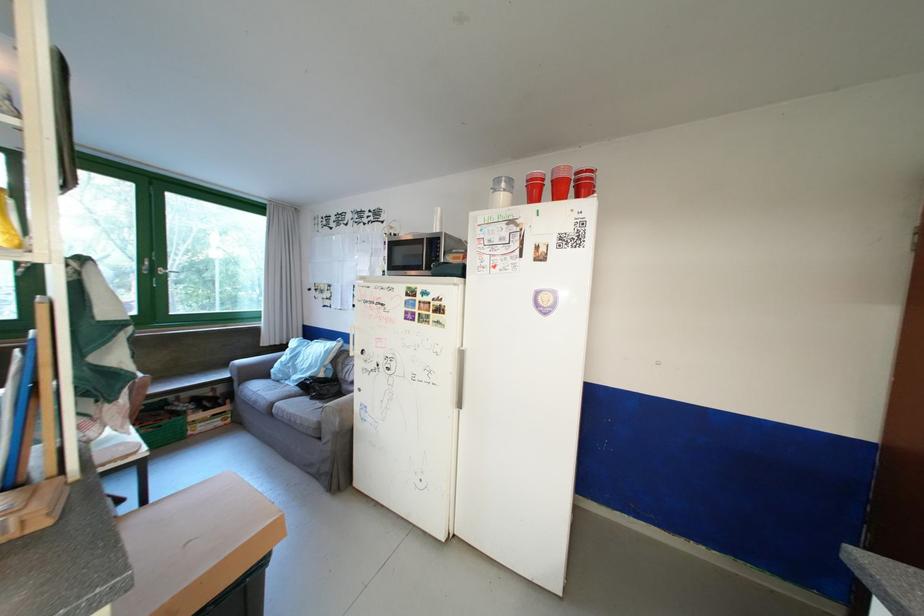
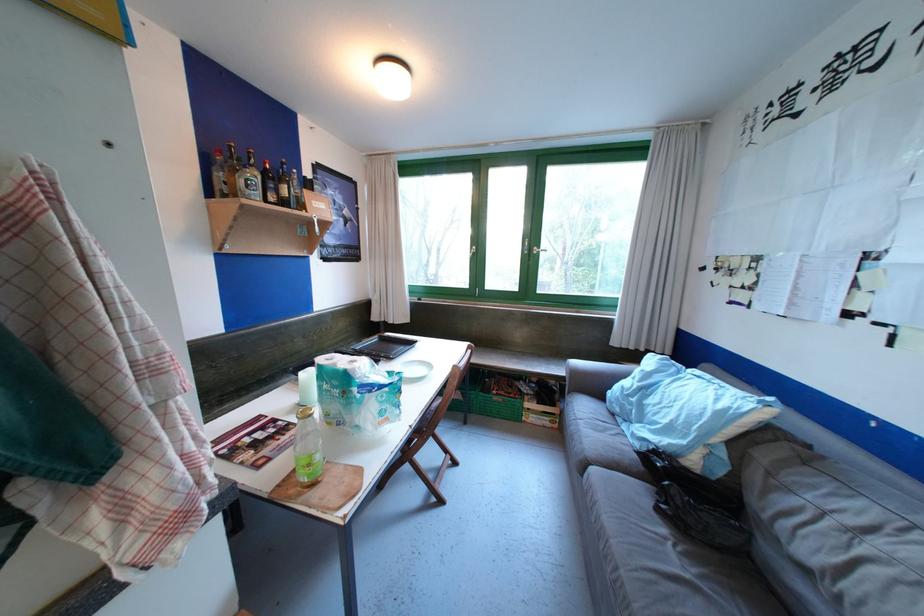
Locate, in the second image, the point that corresponds to [323,363] in the first image.

(697, 426)